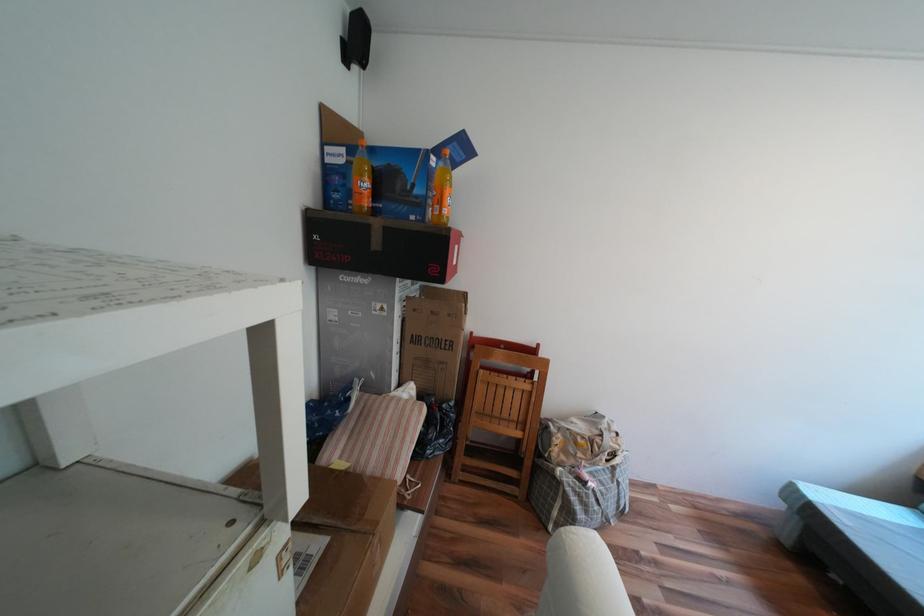
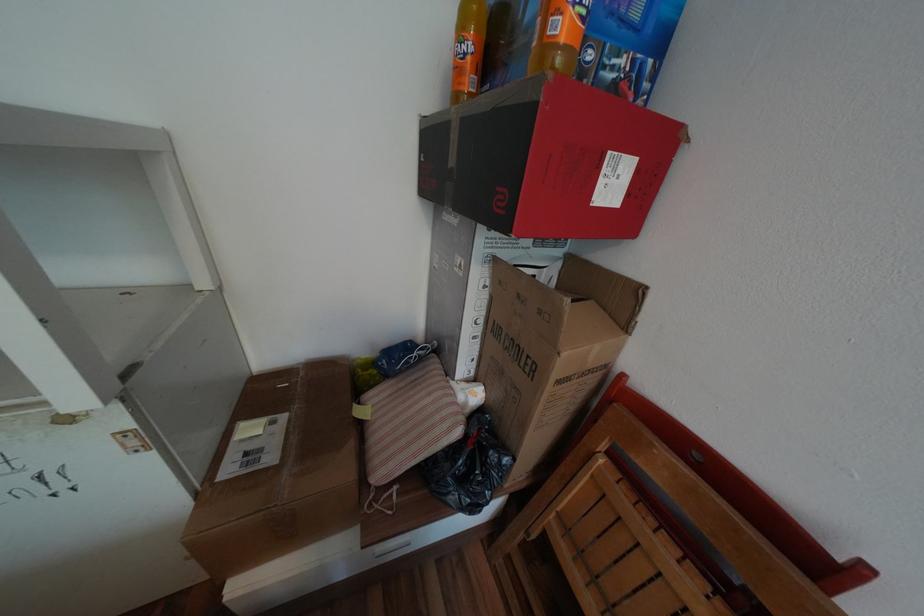
Locate, in the second image, the point that corresponds to pixel 455 211 in the first image.

(569, 26)